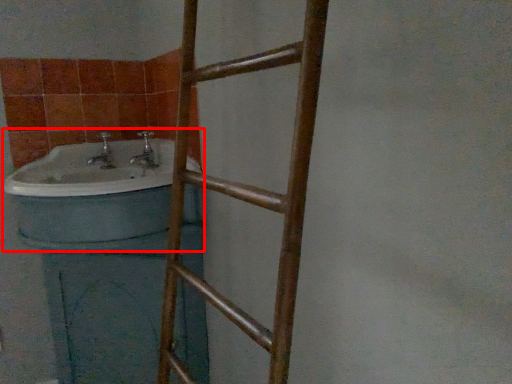
Question: From the image, what is the correct spatial relationship of sink (annotated by the red box) in relation to ladder?

Choices:
 (A) left
 (B) right

Answer: (A)